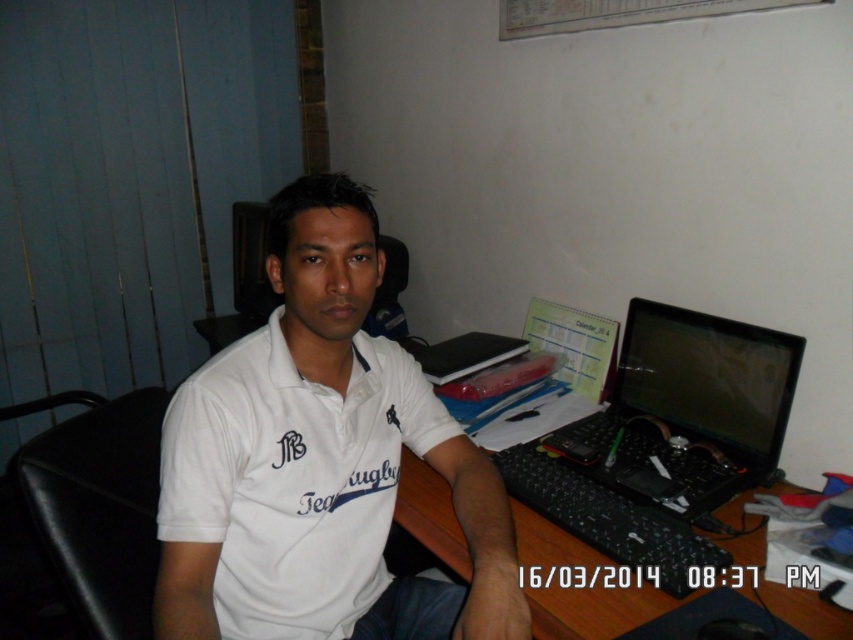
Question: Which point is closer to the camera?

Choices:
 (A) wooden desk at center
 (B) black plastic laptop at right
 (C) black leather chair at left
 (D) white cotton shirt at center

Answer: (D)

Question: Does white cotton shirt at center appear on the left side of black plastic laptop at right?

Choices:
 (A) yes
 (B) no

Answer: (A)

Question: Observing the image, what is the correct spatial positioning of black plastic laptop at right in reference to wooden desk at center?

Choices:
 (A) left
 (B) right

Answer: (B)

Question: Which point appears closest to the camera in this image?

Choices:
 (A) (415, 444)
 (B) (601, 632)
 (C) (755, 390)
 (D) (91, 515)

Answer: (B)

Question: Based on their relative distances, which object is farther from the black plastic laptop at right?

Choices:
 (A) wooden desk at center
 (B) white cotton shirt at center

Answer: (B)

Question: From the image, what is the correct spatial relationship of white cotton shirt at center in relation to black plastic laptop at right?

Choices:
 (A) right
 (B) left

Answer: (B)